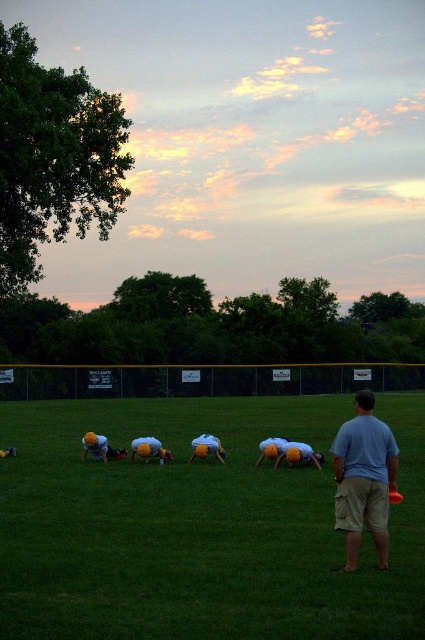
You are a photographer trying to capture the sunset in this scene. You have a yellow fabric at center and a yellow fabric helmet at lower left in your viewfinder. Which object should you zoom in on if you want to focus on the smaller one?

The yellow fabric helmet at lower left is smaller, so you should zoom in on the yellow fabric helmet at lower left to focus on the smaller one.